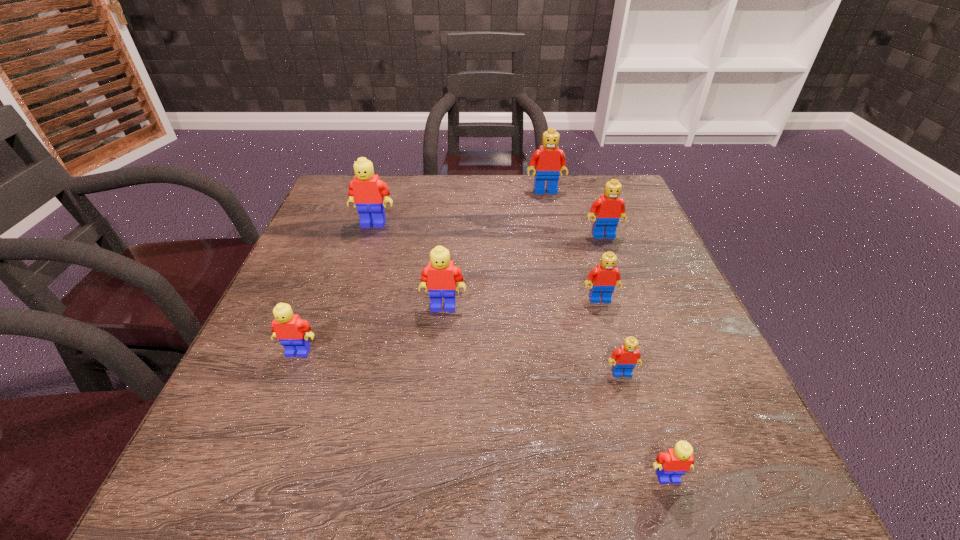
Locate an element on the screen. Image resolution: width=960 pixels, height=540 pixels. vacant space located 0.200m on the front-facing side of the third nearest Lego is located at coordinates (254, 464).

Identify the location of vacant space located 0.060m on the face of the nearest red Lego. (632, 408).

Where is `object that is at the near edge`? object that is at the near edge is located at coordinates (674, 463).

I want to click on object that is at the far left corner, so click(x=366, y=190).

This screenshot has height=540, width=960. In order to click on object that is positioned at the near right corner in this screenshot , I will do `click(674, 463)`.

You are a GUI agent. You are given a task and a screenshot of the screen. Output one action in this format:
    pyautogui.click(x=<x>, y=<y>)
    Task: Click on the vacant position at the far edge of the desktop
    This screenshot has width=960, height=540.
    Given the screenshot: What is the action you would take?
    pyautogui.click(x=506, y=202)

In the image, there is a desktop. Where is `vacant space at the left edge`? Image resolution: width=960 pixels, height=540 pixels. vacant space at the left edge is located at coordinates (287, 379).

Find the location of a particular element. The width and height of the screenshot is (960, 540). vacant area at the right edge is located at coordinates (703, 400).

Locate an element on the screen. blank space at the far right corner of the desktop is located at coordinates (630, 210).

The image size is (960, 540). I want to click on free area in between the nearest red Lego and the second nearest red Lego, so click(x=611, y=336).